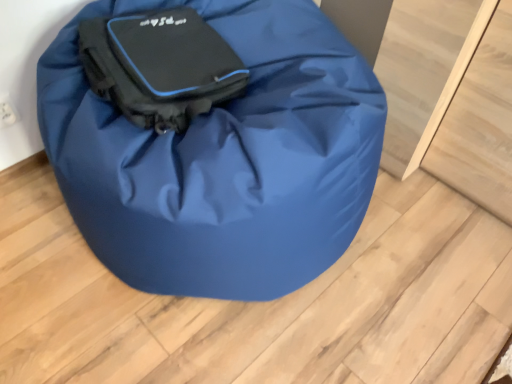
Measure the distance between point (142, 80) and camera.

The depth of point (142, 80) is 39.09 inches.

Describe the element at coordinates (160, 66) in the screenshot. I see `matte black bag at center, acting as the 2th luggage and bags starting from the front` at that location.

In order to face matte black bag at center, acting as the first luggage and bags starting from the back, should I rotate leftwards or rightwards?

It's best to rotate left around 11.357 degrees.

Locate an element on the screen. matte black bag at center, acting as the first luggage and bags starting from the back is located at coordinates pos(160,66).

Locate an element on the screen. This screenshot has height=384, width=512. matte black bag at center, acting as the 2th luggage and bags starting from the back is located at coordinates (223, 158).

This screenshot has width=512, height=384. Describe the element at coordinates (223, 158) in the screenshot. I see `matte black bag at center, acting as the 2th luggage and bags starting from the back` at that location.

Locate an element on the screen. matte black bag at center, acting as the 2th luggage and bags starting from the front is located at coordinates (160, 66).

Considering the positions of objects matte black bag at center, acting as the 2th luggage and bags starting from the back, and matte black bag at center, acting as the 2th luggage and bags starting from the front, in the image provided, who is more to the left, matte black bag at center, acting as the 2th luggage and bags starting from the back, or matte black bag at center, acting as the 2th luggage and bags starting from the front,?

From the viewer's perspective, matte black bag at center, acting as the 2th luggage and bags starting from the front, appears more on the left side.

Between matte black bag at center, acting as the 2th luggage and bags starting from the back, and matte black bag at center, acting as the first luggage and bags starting from the back, which one is positioned behind?

matte black bag at center, acting as the first luggage and bags starting from the back, is further away from the camera.

Is point (142, 189) closer or farther from the camera than point (185, 101)?

Point (142, 189) is positioned closer to the camera compared to point (185, 101).

From the image's perspective, relative to matte black bag at center, acting as the first luggage and bags starting from the back, is matte black bag at center, acting as the 2th luggage and bags starting from the back, above or below?

Clearly, from the image's perspective, matte black bag at center, acting as the 2th luggage and bags starting from the back, is below matte black bag at center, acting as the first luggage and bags starting from the back.

From a real-world perspective, is matte black bag at center, acting as the 2th luggage and bags starting from the back, positioned over matte black bag at center, acting as the 2th luggage and bags starting from the front, based on gravity?

Actually, matte black bag at center, acting as the 2th luggage and bags starting from the back, is physically below matte black bag at center, acting as the 2th luggage and bags starting from the front, in the real world.

Is matte black bag at center, acting as the 2th luggage and bags starting from the back, thinner than matte black bag at center, acting as the first luggage and bags starting from the back?

Incorrect, the width of matte black bag at center, acting as the 2th luggage and bags starting from the back, is not less than that of matte black bag at center, acting as the first luggage and bags starting from the back.

In terms of height, does matte black bag at center, acting as the 2th luggage and bags starting from the back, look taller or shorter compared to matte black bag at center, acting as the first luggage and bags starting from the back?

Clearly, matte black bag at center, acting as the 2th luggage and bags starting from the back, is taller compared to matte black bag at center, acting as the first luggage and bags starting from the back.

Consider the image. Can you confirm if matte black bag at center, acting as the 2th luggage and bags starting from the back, is smaller than matte black bag at center, acting as the first luggage and bags starting from the back?

No, matte black bag at center, acting as the 2th luggage and bags starting from the back, is not smaller than matte black bag at center, acting as the first luggage and bags starting from the back.

Is matte black bag at center, acting as the 2th luggage and bags starting from the front, a part of matte black bag at center, which is the first luggage and bags from front to back?

Indeed, matte black bag at center, acting as the 2th luggage and bags starting from the front, is located within matte black bag at center, which is the first luggage and bags from front to back.

Is there a large distance between matte black bag at center, acting as the 2th luggage and bags starting from the back, and matte black bag at center, acting as the 2th luggage and bags starting from the front?

Actually, matte black bag at center, acting as the 2th luggage and bags starting from the back, and matte black bag at center, acting as the 2th luggage and bags starting from the front, are a little close together.

Is matte black bag at center, acting as the 2th luggage and bags starting from the back, facing away from matte black bag at center, acting as the 2th luggage and bags starting from the front?

matte black bag at center, acting as the 2th luggage and bags starting from the back, is not turned away from matte black bag at center, acting as the 2th luggage and bags starting from the front.

How different are the orientations of matte black bag at center, acting as the 2th luggage and bags starting from the back, and matte black bag at center, acting as the first luggage and bags starting from the back, in degrees?

The angular difference between matte black bag at center, acting as the 2th luggage and bags starting from the back, and matte black bag at center, acting as the first luggage and bags starting from the back, is 8.89 degrees.

How much distance is there between matte black bag at center, acting as the 2th luggage and bags starting from the back, and matte black bag at center, acting as the first luggage and bags starting from the back?

matte black bag at center, acting as the 2th luggage and bags starting from the back, is 7.10 inches from matte black bag at center, acting as the first luggage and bags starting from the back.

This screenshot has width=512, height=384. In order to click on luggage and bags below the matte black bag at center, acting as the 2th luggage and bags starting from the front (from a real-world perspective) in this screenshot , I will do `click(223, 158)`.

Considering the positions of objects matte black bag at center, acting as the 2th luggage and bags starting from the front, and matte black bag at center, acting as the 2th luggage and bags starting from the back, in the image provided, who is more to the right, matte black bag at center, acting as the 2th luggage and bags starting from the front, or matte black bag at center, acting as the 2th luggage and bags starting from the back,?

From the viewer's perspective, matte black bag at center, acting as the 2th luggage and bags starting from the back, appears more on the right side.

Is matte black bag at center, acting as the first luggage and bags starting from the back, further to the viewer compared to matte black bag at center, acting as the 2th luggage and bags starting from the back?

That is True.

Considering the points (183, 41) and (224, 108), which point is behind, point (183, 41) or point (224, 108)?

The point (183, 41) is farther from the camera.

From the image's perspective, is matte black bag at center, acting as the first luggage and bags starting from the back, located above matte black bag at center, which is the first luggage and bags from front to back?

Yes.

From a real-world perspective, who is located higher, matte black bag at center, acting as the 2th luggage and bags starting from the front, or matte black bag at center, which is the first luggage and bags from front to back?

From a 3D spatial view, matte black bag at center, acting as the 2th luggage and bags starting from the front, is above.

Considering the sizes of matte black bag at center, acting as the 2th luggage and bags starting from the front, and matte black bag at center, which is the first luggage and bags from front to back, in the image, is matte black bag at center, acting as the 2th luggage and bags starting from the front, wider or thinner than matte black bag at center, which is the first luggage and bags from front to back,?

Clearly, matte black bag at center, acting as the 2th luggage and bags starting from the front, has less width compared to matte black bag at center, which is the first luggage and bags from front to back.

Is matte black bag at center, acting as the first luggage and bags starting from the back, taller than matte black bag at center, which is the first luggage and bags from front to back?

In fact, matte black bag at center, acting as the first luggage and bags starting from the back, may be shorter than matte black bag at center, which is the first luggage and bags from front to back.

Considering the sizes of objects matte black bag at center, acting as the 2th luggage and bags starting from the front, and matte black bag at center, acting as the 2th luggage and bags starting from the back, in the image provided, who is smaller, matte black bag at center, acting as the 2th luggage and bags starting from the front, or matte black bag at center, acting as the 2th luggage and bags starting from the back,?

With smaller size is matte black bag at center, acting as the 2th luggage and bags starting from the front.

Is matte black bag at center, acting as the first luggage and bags starting from the back, spatially inside matte black bag at center, which is the first luggage and bags from front to back, or outside of it?

matte black bag at center, acting as the first luggage and bags starting from the back, exists entirely within matte black bag at center, which is the first luggage and bags from front to back.

Does matte black bag at center, acting as the 2th luggage and bags starting from the front, touch matte black bag at center, acting as the 2th luggage and bags starting from the back?

No, matte black bag at center, acting as the 2th luggage and bags starting from the front, is not touching matte black bag at center, acting as the 2th luggage and bags starting from the back.

Is matte black bag at center, acting as the 2th luggage and bags starting from the front, positioned with its back to matte black bag at center, which is the first luggage and bags from front to back?

Absolutely, matte black bag at center, acting as the 2th luggage and bags starting from the front, is directed away from matte black bag at center, which is the first luggage and bags from front to back.

How different are the orientations of matte black bag at center, acting as the first luggage and bags starting from the back, and matte black bag at center, which is the first luggage and bags from front to back, in degrees?

They differ by 8.89 degrees in their facing directions.

Image resolution: width=512 pixels, height=384 pixels. In order to click on luggage and bags below the matte black bag at center, acting as the 2th luggage and bags starting from the front (from the image's perspective) in this screenshot , I will do `click(223, 158)`.

Locate an element on the screen. The width and height of the screenshot is (512, 384). luggage and bags above the matte black bag at center, acting as the 2th luggage and bags starting from the back (from a real-world perspective) is located at coordinates (160, 66).

Image resolution: width=512 pixels, height=384 pixels. Identify the location of luggage and bags above the matte black bag at center, which is the first luggage and bags from front to back (from the image's perspective). pyautogui.click(x=160, y=66).